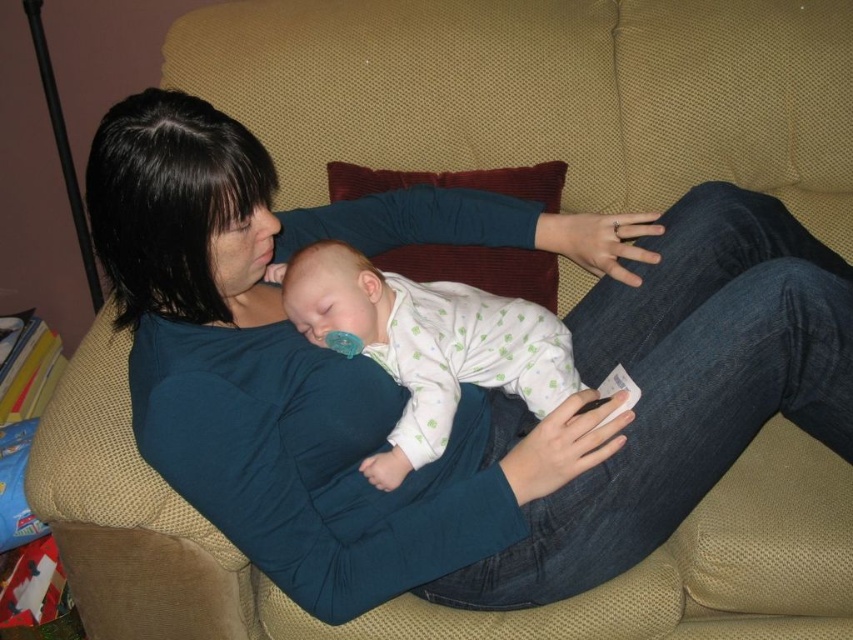
Which of these two, matte blue shirt at center or white dotted fabric at center, stands shorter?

With less height is white dotted fabric at center.

Can you confirm if matte blue shirt at center is thinner than white dotted fabric at center?

In fact, matte blue shirt at center might be wider than white dotted fabric at center.

Is point (149, 321) closer to viewer compared to point (302, 292)?

Yes, point (149, 321) is closer to viewer.

Image resolution: width=853 pixels, height=640 pixels. I want to click on matte blue shirt at center, so click(x=463, y=388).